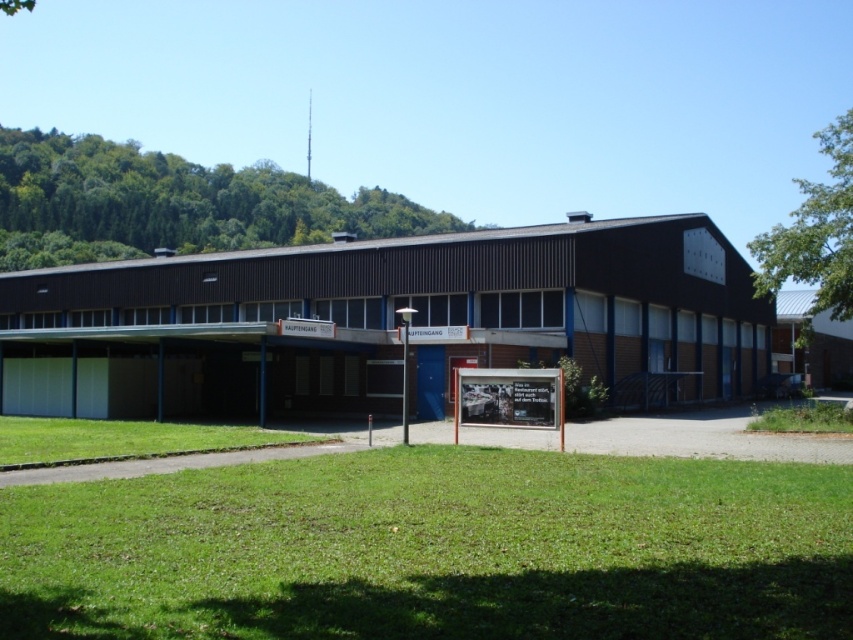
Question: Does green grass at lower center have a lesser width compared to green grass at lower right?

Choices:
 (A) yes
 (B) no

Answer: (A)

Question: Which object is positioned farthest from the green grass at lower right?

Choices:
 (A) green grass at lower left
 (B) green grass at lower center

Answer: (A)

Question: Considering the relative positions of green grass at lower center and green grass at lower left in the image provided, where is green grass at lower center located with respect to green grass at lower left?

Choices:
 (A) right
 (B) left

Answer: (A)

Question: Which point appears closest to the camera in this image?

Choices:
 (A) (793, 403)
 (B) (521, 568)

Answer: (B)

Question: Is green grass at lower center closer to the viewer compared to green grass at lower right?

Choices:
 (A) yes
 (B) no

Answer: (A)

Question: Which of the following is the farthest from the observer?

Choices:
 (A) green grass at lower center
 (B) green grass at lower right
 (C) green grass at lower left

Answer: (B)